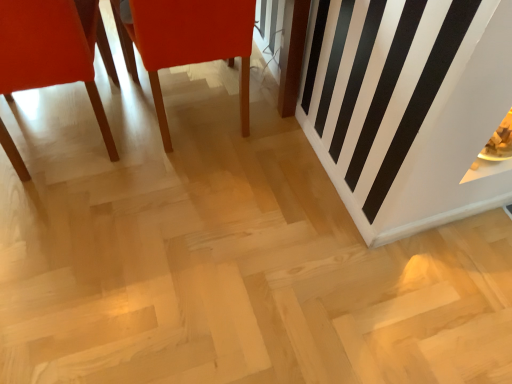
Locate an element on the screen. This screenshot has width=512, height=384. matte orange chair at left, which is the second chair in right-to-left order is located at coordinates (54, 49).

The height and width of the screenshot is (384, 512). Describe the element at coordinates (54, 49) in the screenshot. I see `matte orange chair at left, which is the second chair in right-to-left order` at that location.

How much space does matte wood chair at center, which is counted as the second chair, starting from the left, occupy horizontally?

matte wood chair at center, which is counted as the second chair, starting from the left, is 24.39 inches wide.

What do you see at coordinates (187, 42) in the screenshot? I see `matte wood chair at center, the 1th chair viewed from the right` at bounding box center [187, 42].

In order to face matte wood chair at center, the 1th chair viewed from the right, should I rotate leftwards or rightwards?

To align with it, rotate left about 10.162°.

Where is `matte wood chair at center, which is counted as the second chair, starting from the left`? Image resolution: width=512 pixels, height=384 pixels. matte wood chair at center, which is counted as the second chair, starting from the left is located at coordinates (187, 42).

Identify the location of matte orange chair at left, the 1th chair viewed from the left. This screenshot has height=384, width=512. (54, 49).

Looking at this image, considering the relative positions of matte wood chair at center, the 1th chair viewed from the right, and matte orange chair at left, which is the second chair in right-to-left order, in the image provided, is matte wood chair at center, the 1th chair viewed from the right, to the right of matte orange chair at left, which is the second chair in right-to-left order, from the viewer's perspective?

Indeed, matte wood chair at center, the 1th chair viewed from the right, is positioned on the right side of matte orange chair at left, which is the second chair in right-to-left order.

Which is in front, matte wood chair at center, which is counted as the second chair, starting from the left, or matte orange chair at left, which is the second chair in right-to-left order?

matte orange chair at left, which is the second chair in right-to-left order, is closer to the camera.

Considering the positions of point (221, 9) and point (30, 36), is point (221, 9) closer or farther from the camera than point (30, 36)?

Point (221, 9) is farther from the camera than point (30, 36).

From the image's perspective, which is above, matte wood chair at center, which is counted as the second chair, starting from the left, or matte orange chair at left, the 1th chair viewed from the left?

From the image's view, matte wood chair at center, which is counted as the second chair, starting from the left, is above.

From a real-world perspective, is matte wood chair at center, which is counted as the second chair, starting from the left, physically located above or below matte orange chair at left, the 1th chair viewed from the left?

From a real-world perspective, matte wood chair at center, which is counted as the second chair, starting from the left, is physically below matte orange chair at left, the 1th chair viewed from the left.

Which of these two, matte wood chair at center, which is counted as the second chair, starting from the left, or matte orange chair at left, the 1th chair viewed from the left, is thinner?

matte orange chair at left, the 1th chair viewed from the left.

In terms of height, does matte wood chair at center, which is counted as the second chair, starting from the left, look taller or shorter compared to matte orange chair at left, the 1th chair viewed from the left?

Considering their sizes, matte wood chair at center, which is counted as the second chair, starting from the left, has less height than matte orange chair at left, the 1th chair viewed from the left.

In terms of size, does matte wood chair at center, which is counted as the second chair, starting from the left, appear bigger or smaller than matte orange chair at left, the 1th chair viewed from the left?

Clearly, matte wood chair at center, which is counted as the second chair, starting from the left, is smaller in size than matte orange chair at left, the 1th chair viewed from the left.

Does matte wood chair at center, which is counted as the second chair, starting from the left, contain matte orange chair at left, the 1th chair viewed from the left?

No, matte orange chair at left, the 1th chair viewed from the left, is not surrounded by matte wood chair at center, which is counted as the second chair, starting from the left.

Would you consider matte wood chair at center, the 1th chair viewed from the right, to be distant from matte orange chair at left, which is the second chair in right-to-left order?

matte wood chair at center, the 1th chair viewed from the right, is actually quite close to matte orange chair at left, which is the second chair in right-to-left order.

Does matte wood chair at center, which is counted as the second chair, starting from the left, turn towards matte orange chair at left, which is the second chair in right-to-left order?

No, matte wood chair at center, which is counted as the second chair, starting from the left, is not turned towards matte orange chair at left, which is the second chair in right-to-left order.

Locate an element on the screen. This screenshot has width=512, height=384. chair below the matte wood chair at center, the 1th chair viewed from the right (from the image's perspective) is located at coordinates pos(54,49).

Consider the image. Considering the relative positions of matte orange chair at left, which is the second chair in right-to-left order, and matte wood chair at center, which is counted as the second chair, starting from the left, in the image provided, is matte orange chair at left, which is the second chair in right-to-left order, to the left or to the right of matte wood chair at center, which is counted as the second chair, starting from the left,?

matte orange chair at left, which is the second chair in right-to-left order, is to the left of matte wood chair at center, which is counted as the second chair, starting from the left.

Is matte orange chair at left, the 1th chair viewed from the left, behind matte wood chair at center, which is counted as the second chair, starting from the left?

No, the depth of matte orange chair at left, the 1th chair viewed from the left, is less than that of matte wood chair at center, which is counted as the second chair, starting from the left.

Between point (49, 39) and point (184, 15), which one is positioned in front?

Point (49, 39)

Consider the image. From the image's perspective, which object appears higher, matte orange chair at left, the 1th chair viewed from the left, or matte wood chair at center, which is counted as the second chair, starting from the left?

matte wood chair at center, which is counted as the second chair, starting from the left.

From a real-world perspective, does matte orange chair at left, which is the second chair in right-to-left order, sit lower than matte wood chair at center, which is counted as the second chair, starting from the left?

Actually, matte orange chair at left, which is the second chair in right-to-left order, is physically above matte wood chair at center, which is counted as the second chair, starting from the left, in the real world.

Does matte orange chair at left, the 1th chair viewed from the left, have a lesser width compared to matte wood chair at center, the 1th chair viewed from the right?

Yes, matte orange chair at left, the 1th chair viewed from the left, is thinner than matte wood chair at center, the 1th chair viewed from the right.

Which of these two, matte orange chair at left, which is the second chair in right-to-left order, or matte wood chair at center, which is counted as the second chair, starting from the left, stands taller?

matte orange chair at left, which is the second chair in right-to-left order.

Is matte orange chair at left, the 1th chair viewed from the left, bigger than matte wood chair at center, the 1th chair viewed from the right?

Yes, matte orange chair at left, the 1th chair viewed from the left, is bigger than matte wood chair at center, the 1th chair viewed from the right.

Is matte orange chair at left, the 1th chair viewed from the left, positioned beyond the bounds of matte wood chair at center, which is counted as the second chair, starting from the left?

Yes, matte orange chair at left, the 1th chair viewed from the left, is outside of matte wood chair at center, which is counted as the second chair, starting from the left.

Is the surface of matte orange chair at left, which is the second chair in right-to-left order, in direct contact with matte wood chair at center, the 1th chair viewed from the right?

matte orange chair at left, which is the second chair in right-to-left order, is not next to matte wood chair at center, the 1th chair viewed from the right, and they're not touching.

Is matte orange chair at left, which is the second chair in right-to-left order, facing towards matte wood chair at center, the 1th chair viewed from the right?

No, matte orange chair at left, which is the second chair in right-to-left order, does not turn towards matte wood chair at center, the 1th chair viewed from the right.

Can you tell me how much matte orange chair at left, which is the second chair in right-to-left order, and matte wood chair at center, which is counted as the second chair, starting from the left, differ in facing direction?

0.000131 degrees.

I want to click on chair in front of the matte wood chair at center, the 1th chair viewed from the right, so click(x=54, y=49).

Image resolution: width=512 pixels, height=384 pixels. In order to click on chair on the right of the matte orange chair at left, the 1th chair viewed from the left in this screenshot , I will do `click(187, 42)`.

Where is `chair below the matte wood chair at center, which is counted as the second chair, starting from the left (from the image's perspective)`? The height and width of the screenshot is (384, 512). chair below the matte wood chair at center, which is counted as the second chair, starting from the left (from the image's perspective) is located at coordinates (54, 49).